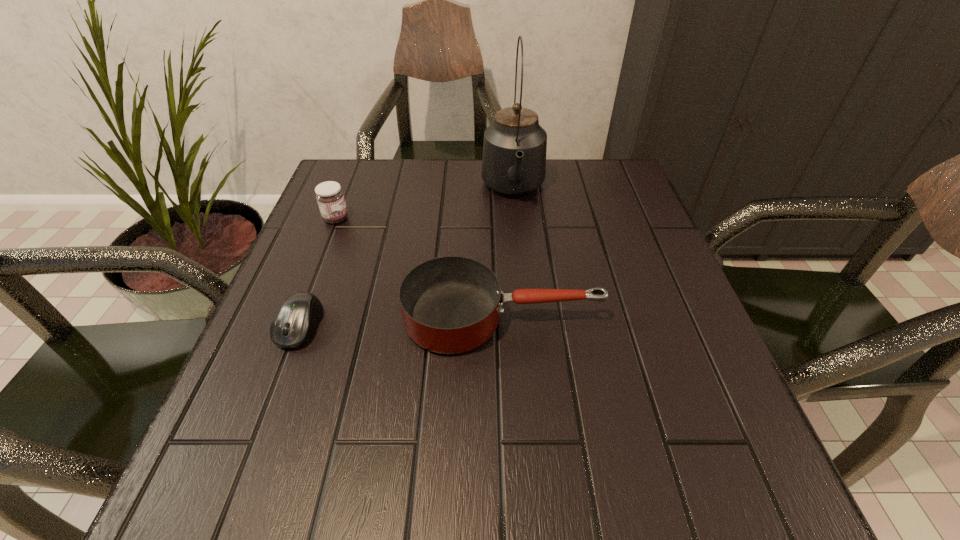
Image resolution: width=960 pixels, height=540 pixels. Identify the location of mouse positioned at the left edge. (293, 324).

In the image, there is a desktop. Where is `vacant space at the far edge`? The height and width of the screenshot is (540, 960). vacant space at the far edge is located at coordinates (558, 164).

The width and height of the screenshot is (960, 540). I want to click on free region at the left edge of the desktop, so click(x=346, y=238).

Find the location of a particular element. vacant space at the right edge of the desktop is located at coordinates (618, 265).

Where is `vacant space at the far left corner of the desktop`? vacant space at the far left corner of the desktop is located at coordinates (344, 181).

Find the location of `vacant position at the near left corner of the desktop`. vacant position at the near left corner of the desktop is located at coordinates (275, 516).

The height and width of the screenshot is (540, 960). Find the location of `free space at the far right corner of the desktop`. free space at the far right corner of the desktop is located at coordinates tap(624, 167).

Where is `free space between the kettle and the pan`? free space between the kettle and the pan is located at coordinates (508, 254).

Where is `vacant area that lies between the kettle and the shortest object`? The height and width of the screenshot is (540, 960). vacant area that lies between the kettle and the shortest object is located at coordinates (407, 258).

At what (x,y) coordinates should I click in order to perform the action: click on free space that is in between the mouse and the jam. Please return your answer as a coordinate pair (x, y). The image size is (960, 540). Looking at the image, I should click on (318, 272).